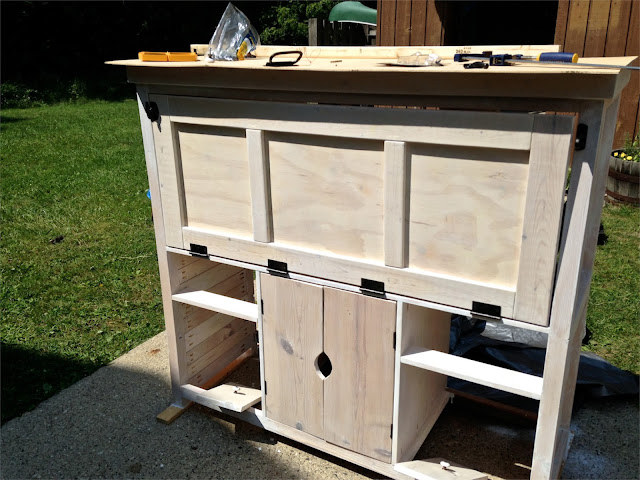
This screenshot has height=480, width=640. I want to click on doors, so click(300, 338), click(355, 343).